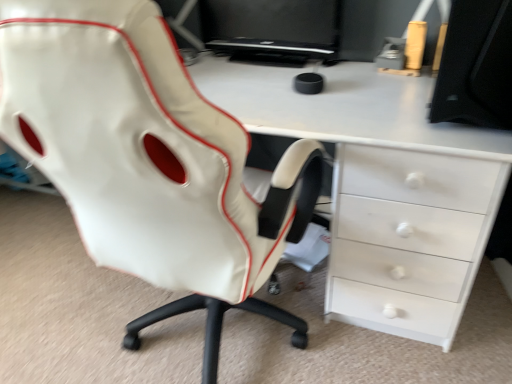
Find the location of `free space in front of black glossy monitor at upper center`. free space in front of black glossy monitor at upper center is located at coordinates (280, 85).